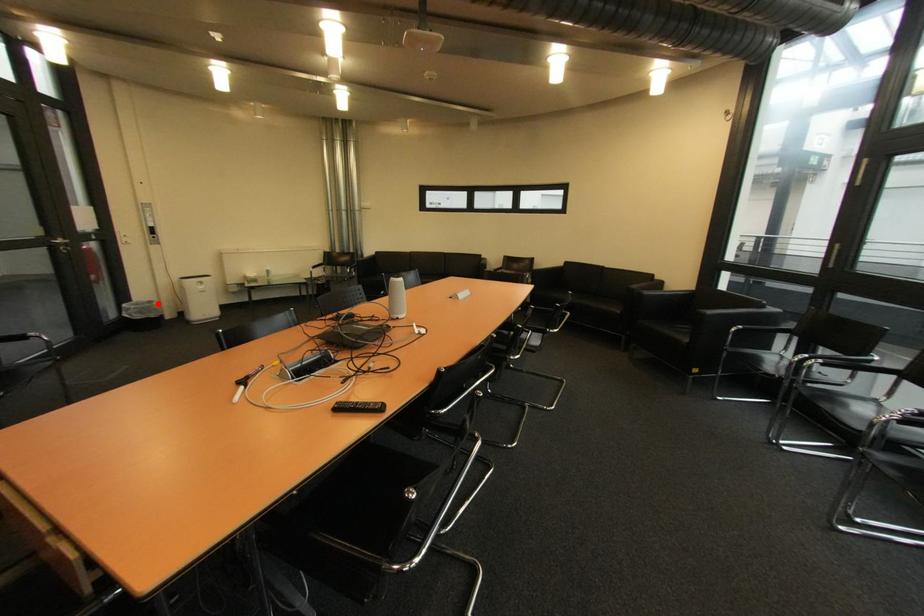
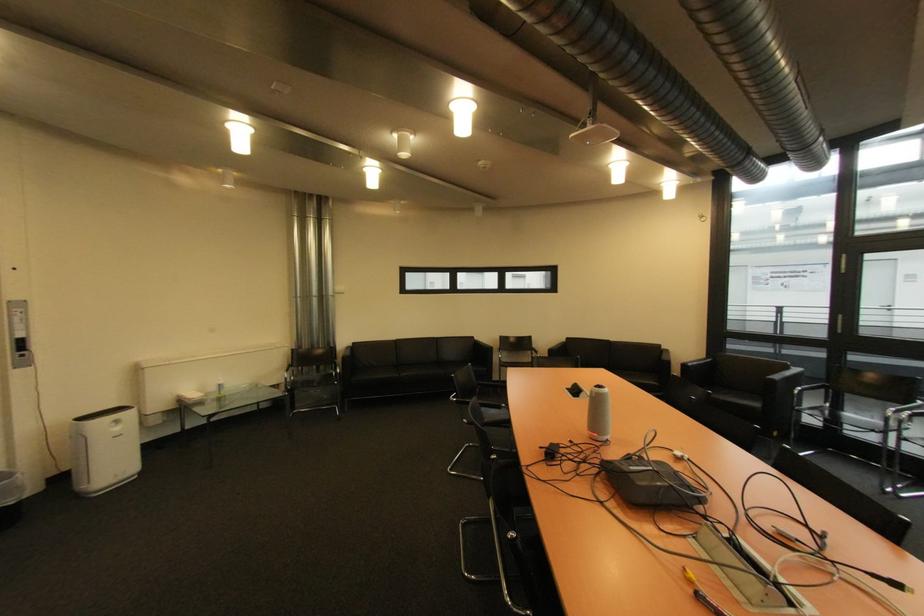
The point at the highlighted location is marked in the first image. Where is the corresponding point in the second image?

(10, 477)